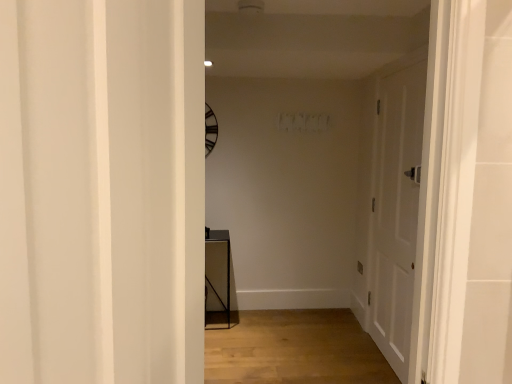
Identify the location of white matte curtain at left. The width and height of the screenshot is (512, 384). (92, 191).

The image size is (512, 384). What do you see at coordinates (92, 191) in the screenshot?
I see `white matte curtain at left` at bounding box center [92, 191].

Where is `white matte curtain at left`? white matte curtain at left is located at coordinates (92, 191).